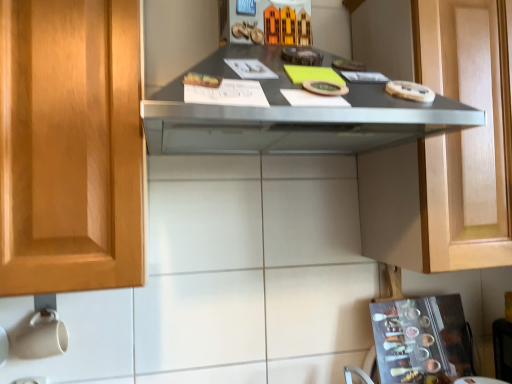
Question: From the image's perspective, is matte gray countertop at center below metallic silver spice rack at lower right?

Choices:
 (A) no
 (B) yes

Answer: (A)

Question: Can you confirm if matte gray countertop at center is taller than metallic silver spice rack at lower right?

Choices:
 (A) no
 (B) yes

Answer: (B)

Question: Considering the relative positions of matte gray countertop at center and metallic silver spice rack at lower right in the image provided, is matte gray countertop at center to the left of metallic silver spice rack at lower right from the viewer's perspective?

Choices:
 (A) no
 (B) yes

Answer: (B)

Question: Does matte gray countertop at center lie behind metallic silver spice rack at lower right?

Choices:
 (A) no
 (B) yes

Answer: (A)

Question: Is matte gray countertop at center wider than metallic silver spice rack at lower right?

Choices:
 (A) no
 (B) yes

Answer: (B)

Question: Considering the positions of point (452, 322) and point (283, 120), is point (452, 322) closer or farther from the camera than point (283, 120)?

Choices:
 (A) closer
 (B) farther

Answer: (B)

Question: From their relative heights in the image, would you say metallic silver spice rack at lower right is taller or shorter than matte gray countertop at center?

Choices:
 (A) short
 (B) tall

Answer: (A)

Question: Relative to matte gray countertop at center, is metallic silver spice rack at lower right in front or behind?

Choices:
 (A) front
 (B) behind

Answer: (B)

Question: Considering the positions of metallic silver spice rack at lower right and matte gray countertop at center in the image, is metallic silver spice rack at lower right wider or thinner than matte gray countertop at center?

Choices:
 (A) wide
 (B) thin

Answer: (B)

Question: From the image's perspective, is metallic silver spice rack at lower right above or below matte wood cabinet at upper right?

Choices:
 (A) below
 (B) above

Answer: (A)

Question: Choose the correct answer: Is metallic silver spice rack at lower right inside matte wood cabinet at upper right or outside it?

Choices:
 (A) inside
 (B) outside

Answer: (B)

Question: Does point (399, 360) appear closer or farther from the camera than point (414, 162)?

Choices:
 (A) closer
 (B) farther

Answer: (B)

Question: Considering the positions of metallic silver spice rack at lower right and matte wood cabinet at upper right in the image, is metallic silver spice rack at lower right wider or thinner than matte wood cabinet at upper right?

Choices:
 (A) thin
 (B) wide

Answer: (A)

Question: Considering the positions of matte gray countertop at center and matte wood cabinet at upper right in the image, is matte gray countertop at center bigger or smaller than matte wood cabinet at upper right?

Choices:
 (A) big
 (B) small

Answer: (B)

Question: Does point (388, 132) appear closer or farther from the camera than point (496, 92)?

Choices:
 (A) closer
 (B) farther

Answer: (A)